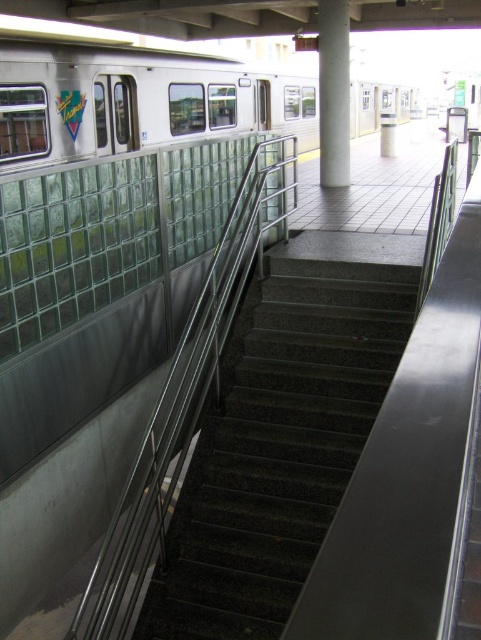
Question: Which of the following is the farthest from the observer?

Choices:
 (A) white glossy pillar at upper center
 (B) silver metallic train at upper left

Answer: (A)

Question: Which is farther from the silver metallic train at upper left?

Choices:
 (A) white glossy pillar at upper center
 (B) granite stairs at center

Answer: (B)

Question: Does silver metallic train at upper left appear on the left side of white glossy pillar at upper center?

Choices:
 (A) no
 (B) yes

Answer: (A)

Question: Can you confirm if granite stairs at center is bigger than silver metallic train at upper left?

Choices:
 (A) yes
 (B) no

Answer: (B)

Question: Can you confirm if granite stairs at center is thinner than white glossy pillar at upper center?

Choices:
 (A) yes
 (B) no

Answer: (B)

Question: Which point appears closest to the camera in this image?

Choices:
 (A) coord(200,120)
 (B) coord(338,64)

Answer: (B)